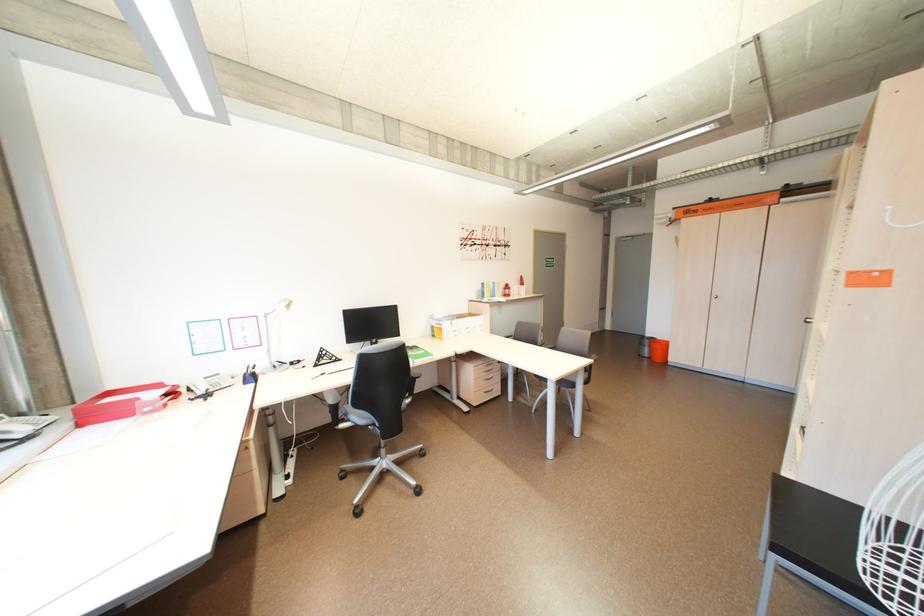
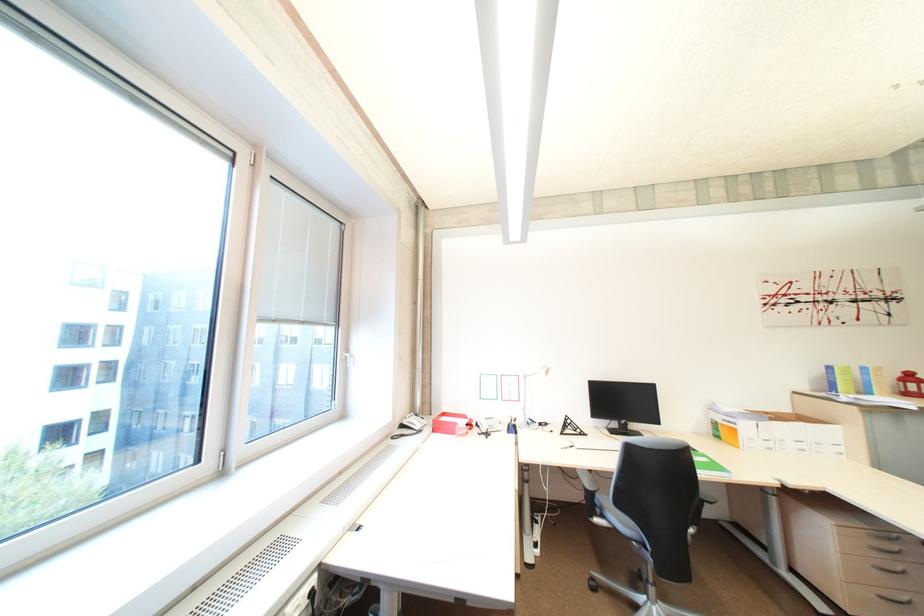
In the second image, find the point that corresponds to (514,290) in the first image.

(913, 382)